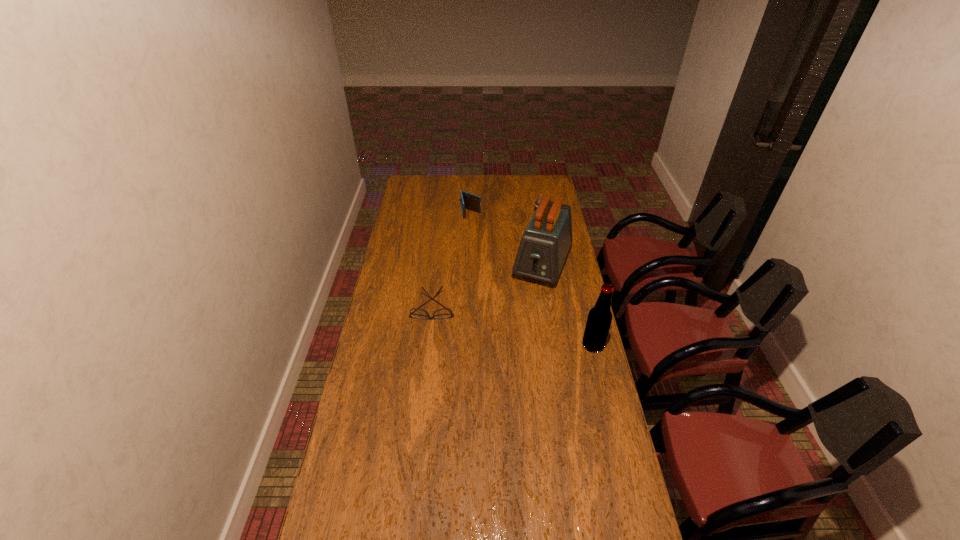
You are a GUI agent. You are given a task and a screenshot of the screen. Output one action in this format:
    pyautogui.click(x=<x>, y=<y>)
    Task: Click on the vacant space in between the fourth object from right to left and the leftmost object
    The height and width of the screenshot is (540, 960).
    Given the screenshot: What is the action you would take?
    pyautogui.click(x=452, y=260)

Locate an element on the screen. vacant space in between the beer bottle and the spectacles is located at coordinates (513, 326).

I want to click on vacant space in between the nearest object and the third nearest object, so click(x=567, y=305).

Find the location of a particular element. free area in between the beer bottle and the kitten is located at coordinates (565, 278).

Identify the location of free space between the shortest object and the second object from left to right. The width and height of the screenshot is (960, 540). (452, 260).

The width and height of the screenshot is (960, 540). Find the location of `vacant point located between the leftmost object and the fourth object from right to left`. vacant point located between the leftmost object and the fourth object from right to left is located at coordinates (452, 260).

Where is `object that is the closest to the beer bottle`? Image resolution: width=960 pixels, height=540 pixels. object that is the closest to the beer bottle is located at coordinates (544, 246).

Locate an element on the screen. The height and width of the screenshot is (540, 960). object that is the closest to the second nearest object is located at coordinates (544, 246).

Locate an element on the screen. The image size is (960, 540). free space that satisfies the following two spatial constraints: 1. on the front side of the kitten; 2. on the left side of the beer bottle is located at coordinates 562,345.